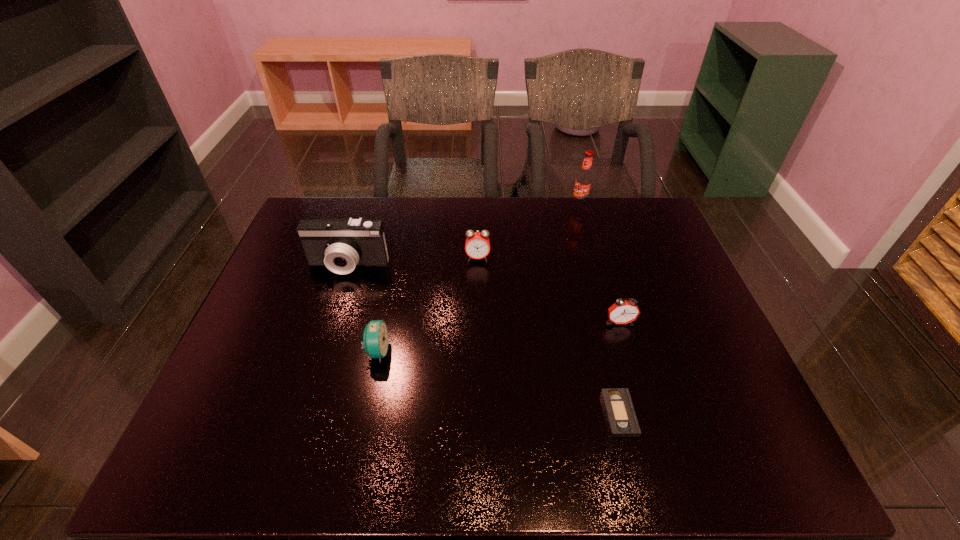
Identify the location of vacant space at the far edge of the desktop. (470, 199).

In order to click on vacant space at the near edge of the desktop in this screenshot , I will do `click(615, 454)`.

I want to click on vacant area at the left edge of the desktop, so click(255, 313).

Identify the location of vacant space at the right edge of the desktop. The width and height of the screenshot is (960, 540). (754, 405).

You are a GUI agent. You are given a task and a screenshot of the screen. Output one action in this format:
    pyautogui.click(x=<x>, y=<y>)
    Task: Click on the blank region between the rightmost alarm clock and the nearest alarm clock
    This screenshot has width=960, height=540.
    Given the screenshot: What is the action you would take?
    pyautogui.click(x=498, y=336)

Find the location of `vacant space in between the second alarm clock from left to right and the camcorder`. vacant space in between the second alarm clock from left to right and the camcorder is located at coordinates (413, 262).

Where is `free space between the root beer and the second nearest object`? Image resolution: width=960 pixels, height=540 pixels. free space between the root beer and the second nearest object is located at coordinates (479, 278).

What are the coordinates of `free space between the shortest object and the farthest object` in the screenshot? It's located at (599, 309).

Identify the location of vacant area that lies between the leftmost alarm clock and the camcorder. (363, 308).

The image size is (960, 540). What are the coordinates of `vacant space that's between the second nearest object and the camcorder` in the screenshot? It's located at (363, 308).